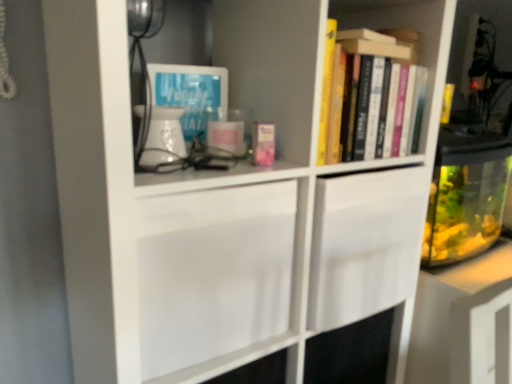
Question: From the image's perspective, is transparent glass fish tank at right positioned above or below blue paper at upper left?

Choices:
 (A) below
 (B) above

Answer: (A)

Question: Is transparent glass fish tank at right spatially inside blue paper at upper left, or outside of it?

Choices:
 (A) outside
 (B) inside

Answer: (A)

Question: Based on their relative distances, which object is nearer to the hardcover books at upper right, the first book in the back-to-front sequence?

Choices:
 (A) transparent glass fish tank at right
 (B) pink matte book at center, the 2th book in the right-to-left sequence
 (C) white plastic corded phone at upper left
 (D) blue paper at upper left

Answer: (B)

Question: Considering the real-world distances, which object is closest to the pink matte book at center, the 2th book in the right-to-left sequence?

Choices:
 (A) white plastic corded phone at upper left
 (B) transparent glass fish tank at right
 (C) blue paper at upper left
 (D) hardcover books at upper right, the first book positioned from the right

Answer: (C)